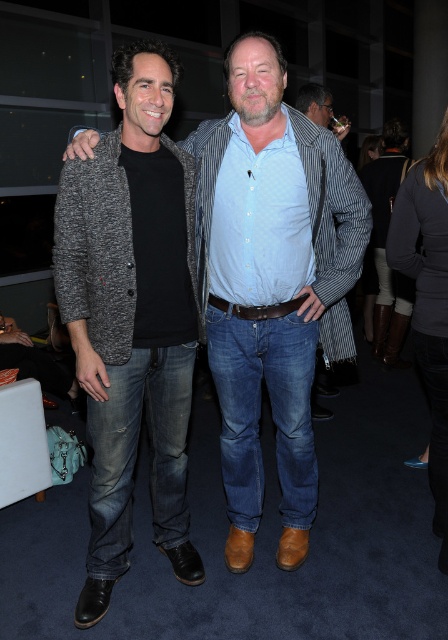
Is matte gray sweater at center thinner than matte gray cardigan at center?

In fact, matte gray sweater at center might be wider than matte gray cardigan at center.

Image resolution: width=448 pixels, height=640 pixels. Find the location of `matte gray sweater at center`. matte gray sweater at center is located at coordinates (271, 284).

Which is in front, point (304, 451) or point (124, 557)?

Positioned in front is point (124, 557).

This screenshot has height=640, width=448. What are the coordinates of `matte gray sweater at center` in the screenshot? It's located at (271, 284).